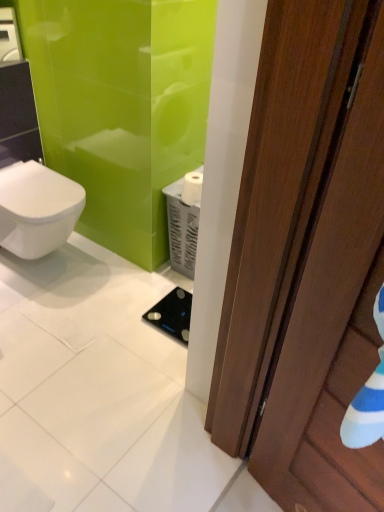
Question: From a real-world perspective, is white glossy bidet at left above or below brown wooden door at right?

Choices:
 (A) below
 (B) above

Answer: (A)

Question: In terms of size, does white glossy bidet at left appear bigger or smaller than brown wooden door at right?

Choices:
 (A) big
 (B) small

Answer: (A)

Question: Estimate the real-world distances between objects in this image. Which object is farther from the white glossy bidet at left?

Choices:
 (A) brown wooden door at right
 (B) white matte toilet paper at center
 (C) black glass scale at center

Answer: (A)

Question: Which object is the farthest from the black glass scale at center?

Choices:
 (A) white glossy bidet at left
 (B) brown wooden door at right
 (C) white matte toilet paper at center

Answer: (B)